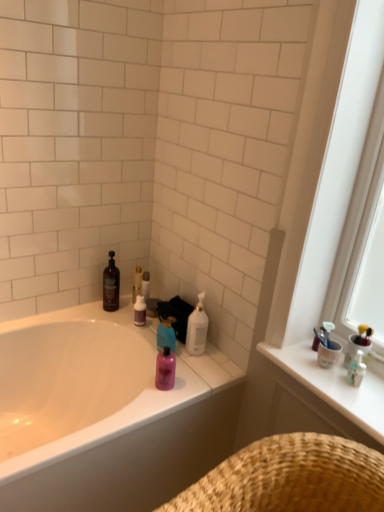
I want to click on free space in front of translucent plastic toothbrush holder at upper right, the 3th toiletry in the left-to-right sequence, so click(360, 403).